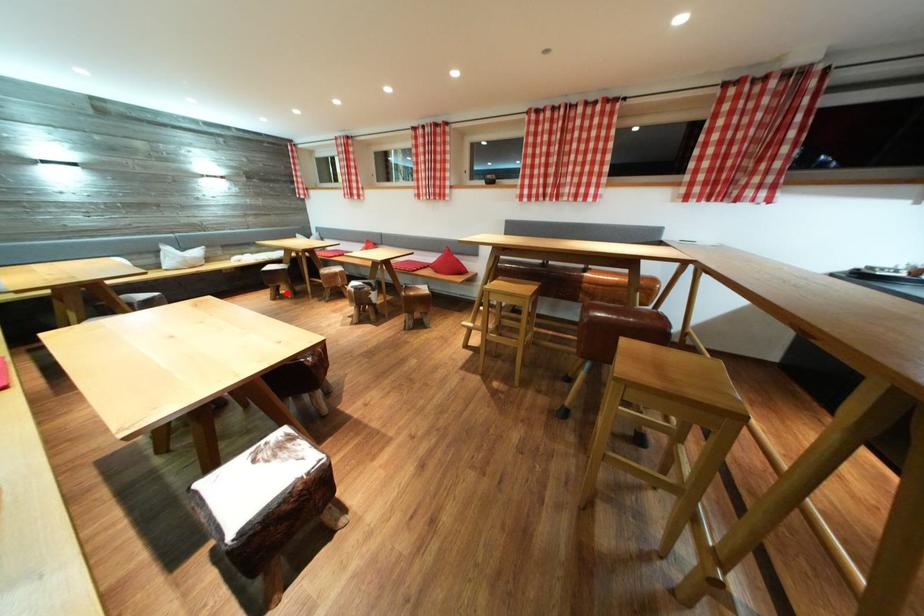
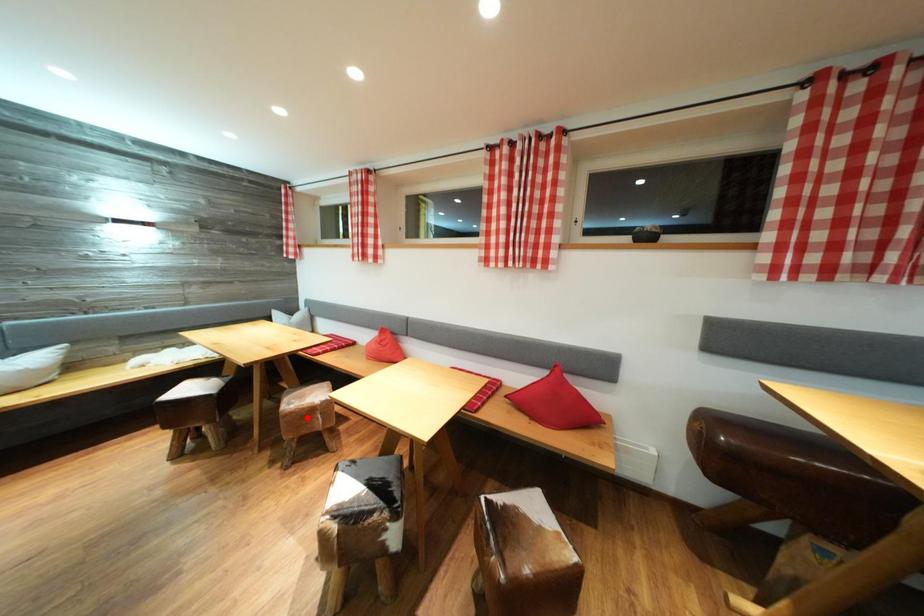
I am providing you with two images of the same scene from different viewpoints. A red point is marked on the first image and another point is marked on the second image. Do the highlighted points in image1 and image2 indicate the same real-world spot?

No